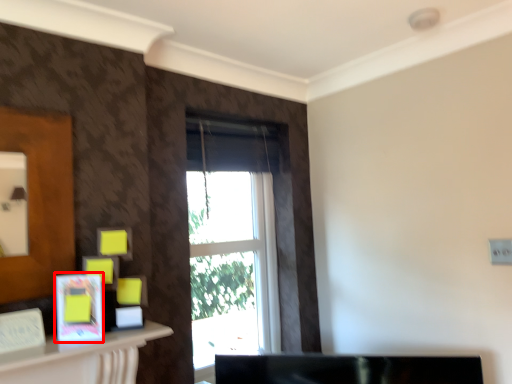
Question: Observing the image, what is the correct spatial positioning of picture frame (annotated by the red box) in reference to window?

Choices:
 (A) right
 (B) left

Answer: (B)